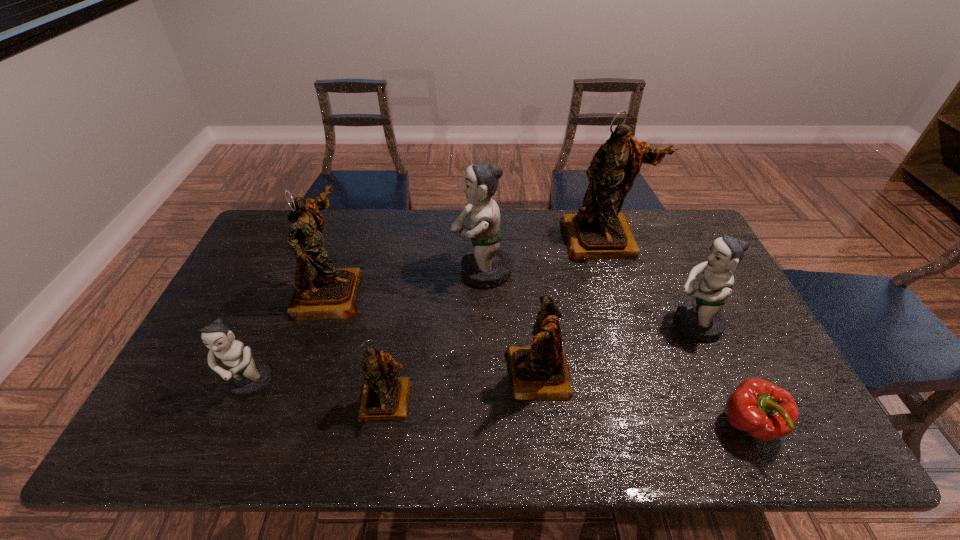
Find the location of a particular element. This screenshot has height=540, width=960. free space located 0.340m on the front-facing side of the second farthest green figurine is located at coordinates (547, 324).

Find the location of a particular element. The height and width of the screenshot is (540, 960). vacant area situated 0.240m on the front-facing side of the second farthest green figurine is located at coordinates (583, 324).

Identify the location of free space located on the front-facing side of the second farthest green figurine. Image resolution: width=960 pixels, height=540 pixels. (650, 324).

I want to click on free space located on the front-facing side of the third biggest gold figurine, so click(424, 376).

The image size is (960, 540). Find the location of `free space located 0.340m on the front-facing side of the third biggest gold figurine`. free space located 0.340m on the front-facing side of the third biggest gold figurine is located at coordinates (373, 376).

Where is `vacant space located 0.310m on the front-facing side of the third biggest gold figurine`? Image resolution: width=960 pixels, height=540 pixels. vacant space located 0.310m on the front-facing side of the third biggest gold figurine is located at coordinates (385, 376).

This screenshot has height=540, width=960. I want to click on free space located 0.200m on the back of the pink pepper, so click(x=707, y=334).

Where is `object at the far edge`? Image resolution: width=960 pixels, height=540 pixels. object at the far edge is located at coordinates (598, 231).

Where is `figurine that is positioned at the near edge`? This screenshot has height=540, width=960. figurine that is positioned at the near edge is located at coordinates (384, 397).

The width and height of the screenshot is (960, 540). In order to click on pepper that is at the near edge in this screenshot , I will do `click(767, 412)`.